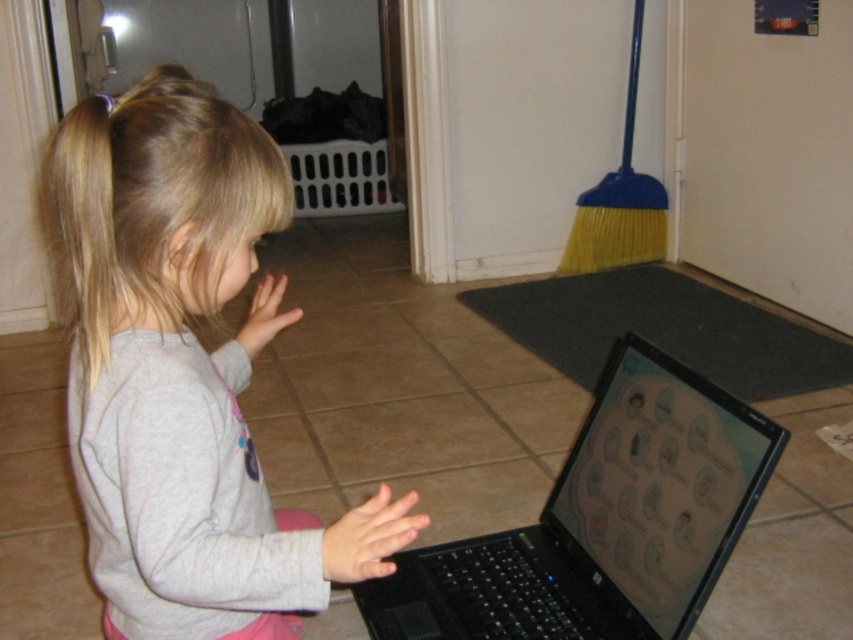
You are a delivery robot trying to navigate to a package located at point (433,547). You are currently at point (267,284). According to the image, which direction should you move to reach the package?

Point (267,284) is in front of point (433,547), so you should move backward to reach the package.

Consider the image. You are a delivery person who just arrived at the address and see the image. You need to place a small package on the surface that is higher between the gray soft fabric at center and the black plastic laptop at center. Which one should you choose?

The gray soft fabric at center has a greater height compared to the black plastic laptop at center, so you should place the package on the gray soft fabric at center.

You are a delivery person who needs to place a small package on the gray soft fabric at center. The package must be placed exactly at the coordinates provided in the Objects Description. What are the coordinates where you should place the package?

The gray soft fabric at center is located at point (183, 369), so you should place the package at those coordinates.